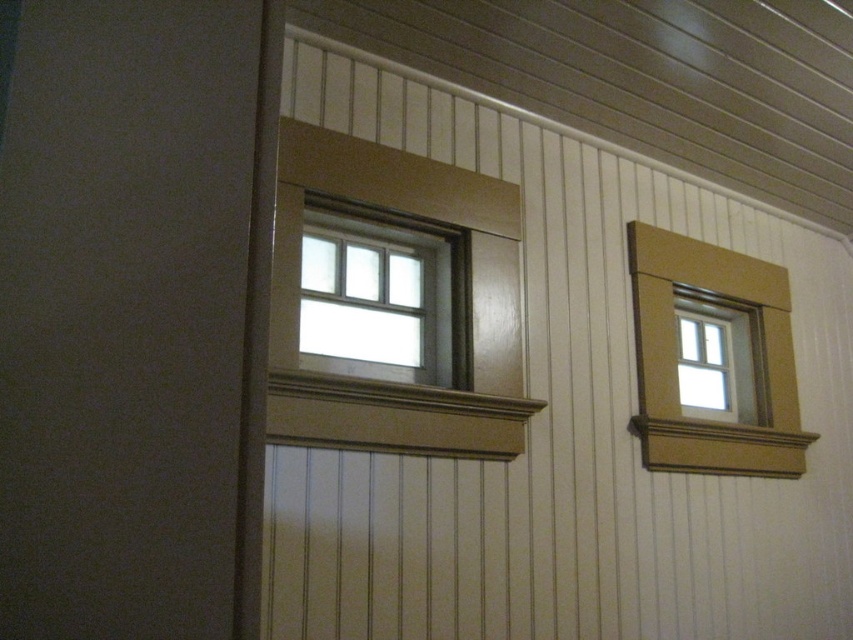
Which is behind, point (125, 218) or point (412, 244)?

The point (412, 244) is more distant.

Identify the location of matte brown siding at left. The width and height of the screenshot is (853, 640). (x=128, y=314).

Who is more distant from viewer, (115, 124) or (453, 278)?

Answer: Point (453, 278)

Locate an element on the screen. matte brown siding at left is located at coordinates (128, 314).

Which is in front, point (619, 307) or point (509, 268)?

Point (509, 268)

The width and height of the screenshot is (853, 640). Describe the element at coordinates (566, 426) in the screenshot. I see `wooden siding at upper left` at that location.

Locate an element on the screen. This screenshot has width=853, height=640. wooden siding at upper left is located at coordinates (566, 426).

Who is taller, matte wood window frame at upper left or matte glass window at upper center?

matte wood window frame at upper left is taller.

Between matte wood window frame at upper left and matte glass window at upper center, which one appears on the right side from the viewer's perspective?

matte wood window frame at upper left is more to the right.

Which is in front, point (376, 387) or point (384, 346)?

Point (376, 387) is in front.

The width and height of the screenshot is (853, 640). What are the coordinates of `matte wood window frame at upper left` in the screenshot? It's located at (453, 321).